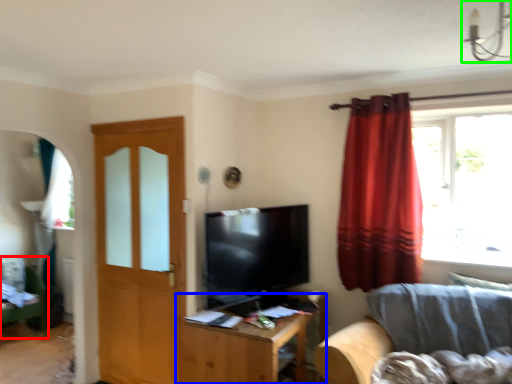
Question: Which object is positioned farthest from swivel chair (highlighted by a red box)? Select from table (highlighted by a blue box) and light fixture (highlighted by a green box).

Choices:
 (A) table
 (B) light fixture

Answer: (B)